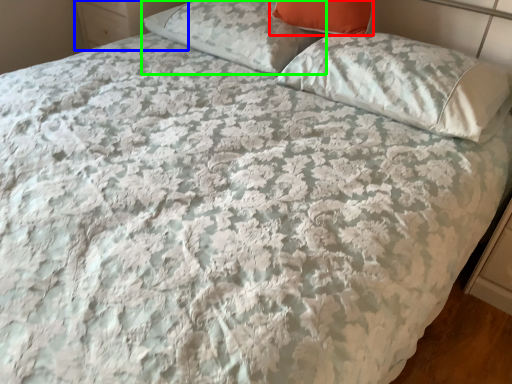
Question: Based on their relative distances, which object is farther from pillow (highlighted by a red box)? Choose from dresser (highlighted by a blue box) and pillow (highlighted by a green box).

Choices:
 (A) dresser
 (B) pillow

Answer: (A)